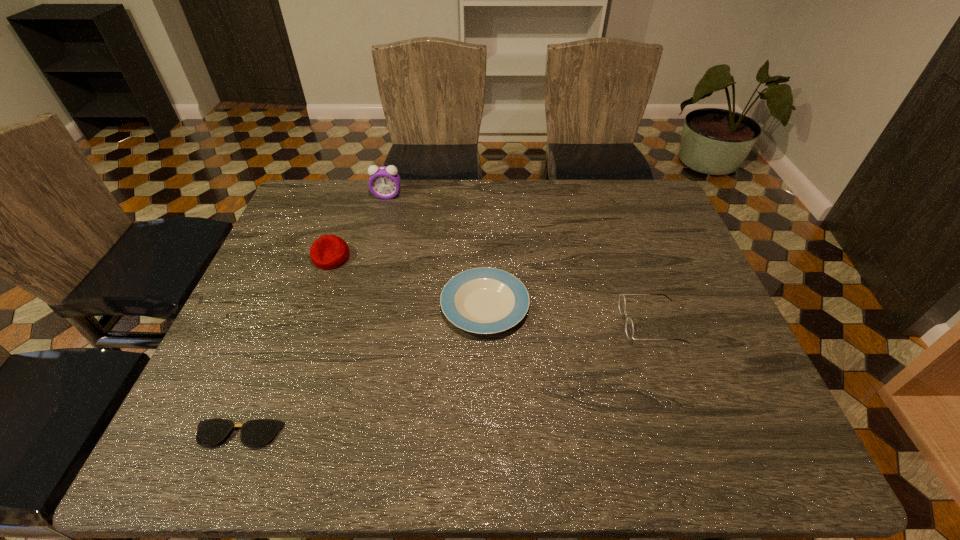
Identify the location of object that is the closest to the tallest object. (329, 251).

This screenshot has width=960, height=540. What are the coordinates of `free space that satisfies the following two spatial constraints: 1. on the seat area of the fourth tallest object; 2. on the right side of the second farthest object` in the screenshot? It's located at (315, 306).

Find the location of a particular element. free location that satisfies the following two spatial constraints: 1. on the seat area of the second tallest object; 2. on the right side of the second shortest object is located at coordinates click(x=315, y=306).

Where is `free region that satisfies the following two spatial constraints: 1. on the face of the third object from right to left; 2. on the right side of the second object from right to left`? free region that satisfies the following two spatial constraints: 1. on the face of the third object from right to left; 2. on the right side of the second object from right to left is located at coordinates (359, 306).